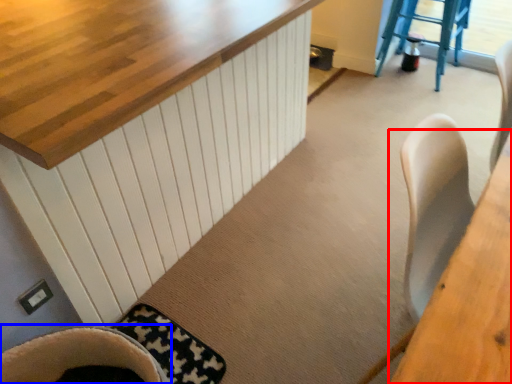
Question: Among these objects, which one is farthest to the camera, table (highlighted by a red box) or chair (highlighted by a blue box)?

Choices:
 (A) table
 (B) chair

Answer: (B)